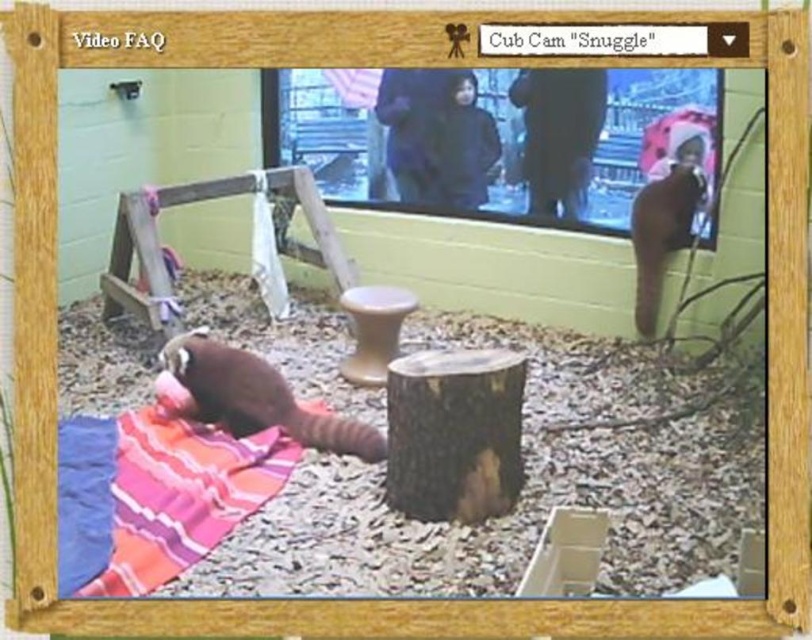
Question: Among these points, which one is nearest to the camera?

Choices:
 (A) (370, 385)
 (B) (132, 524)
 (C) (238, 392)

Answer: (B)

Question: Which of these objects is positioned closest to the brown fuzzy animal at lower left?

Choices:
 (A) smooth brown stool at center
 (B) striped cotton blanket at lower left

Answer: (B)

Question: Is striped cotton blanket at lower left thinner than smooth brown stool at center?

Choices:
 (A) yes
 (B) no

Answer: (B)

Question: Which point is closer to the camera?

Choices:
 (A) brown fuzzy animal at lower left
 (B) striped cotton blanket at lower left

Answer: (B)

Question: Is striped cotton blanket at lower left below smooth brown stool at center?

Choices:
 (A) yes
 (B) no

Answer: (A)

Question: Can you confirm if striped cotton blanket at lower left is positioned below brown fuzzy animal at lower left?

Choices:
 (A) yes
 (B) no

Answer: (A)